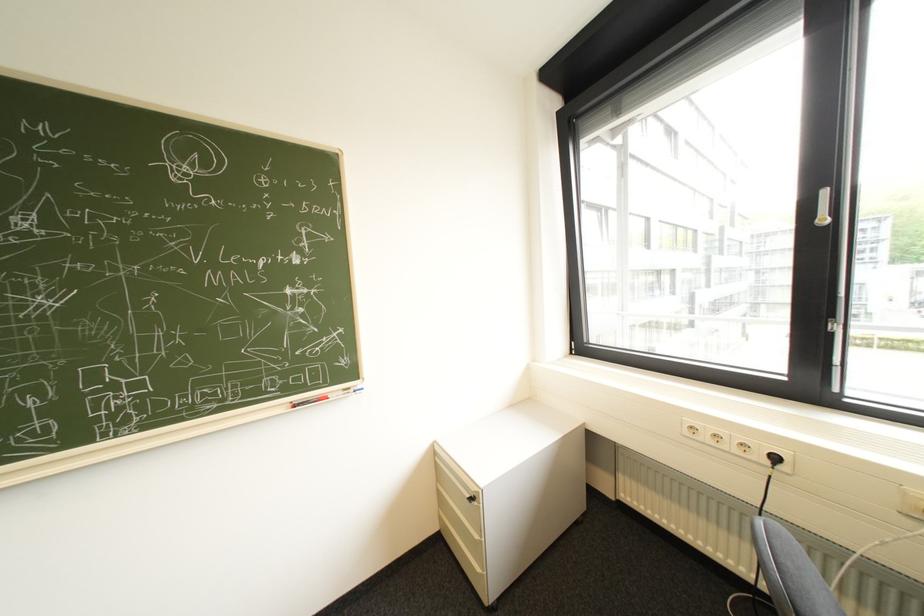
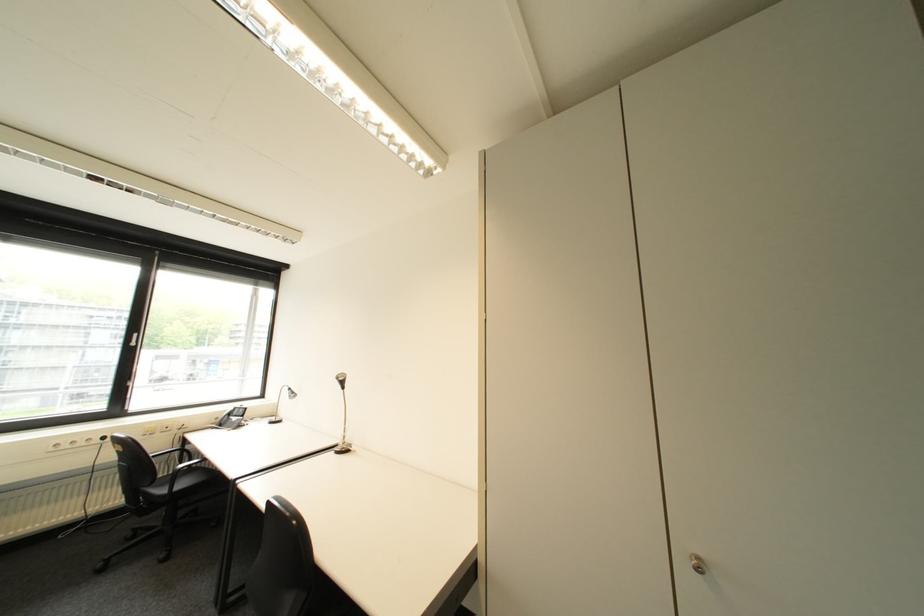
Locate, in the second image, the point that corresponds to (x=785, y=459) in the first image.

(114, 439)